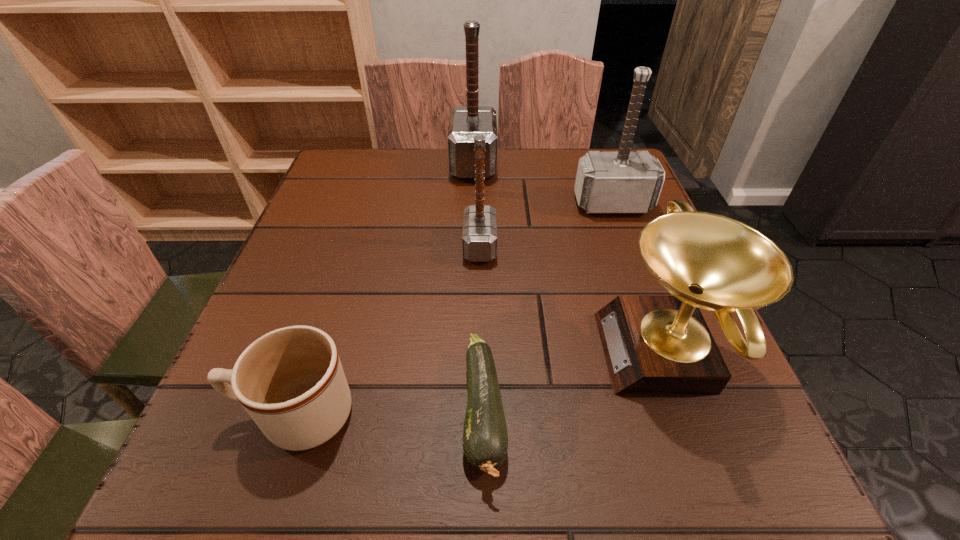
Locate an element on the screen. This screenshot has width=960, height=540. the farthest object is located at coordinates (466, 122).

This screenshot has height=540, width=960. I want to click on the second nearest hammer, so click(623, 182).

At what (x,y) coordinates should I click in order to perform the action: click on the second farthest object. Please return your answer as a coordinate pair (x, y). The width and height of the screenshot is (960, 540). Looking at the image, I should click on (623, 182).

At what (x,y) coordinates should I click in order to perform the action: click on the shortest hammer. Please return your answer as a coordinate pair (x, y). Image resolution: width=960 pixels, height=540 pixels. Looking at the image, I should click on (479, 234).

The image size is (960, 540). I want to click on the third farthest object, so click(479, 234).

Where is `award`? The image size is (960, 540). award is located at coordinates (653, 344).

This screenshot has height=540, width=960. Find the location of `the second shortest object`. the second shortest object is located at coordinates (290, 381).

Where is `the leftmost object`? the leftmost object is located at coordinates (290, 381).

At what (x,y) coordinates should I click in order to perform the action: click on the shortest object. Please return your answer as a coordinate pair (x, y). The width and height of the screenshot is (960, 540). Looking at the image, I should click on pos(485,439).

The width and height of the screenshot is (960, 540). I want to click on vacant space situated on the left of the farthest hammer, so click(x=432, y=165).